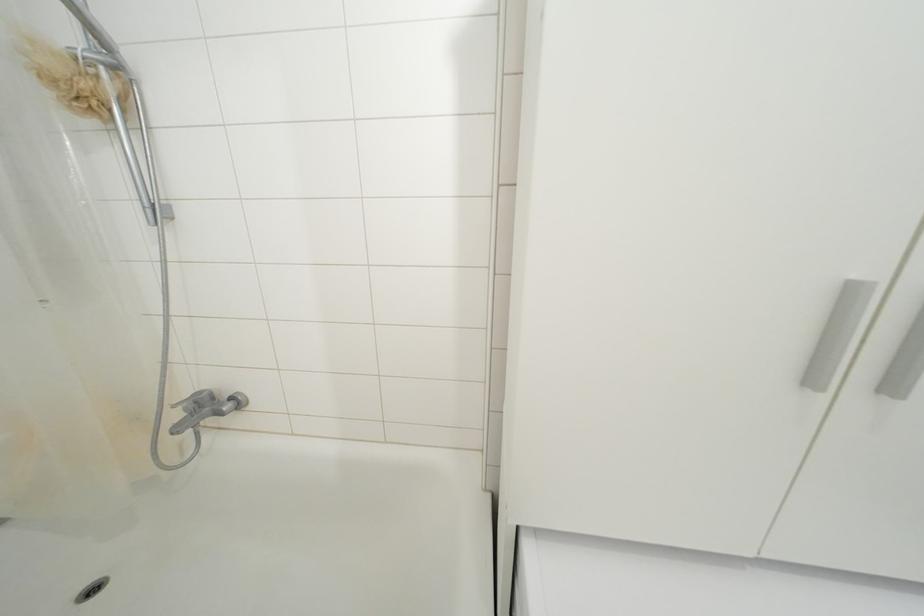
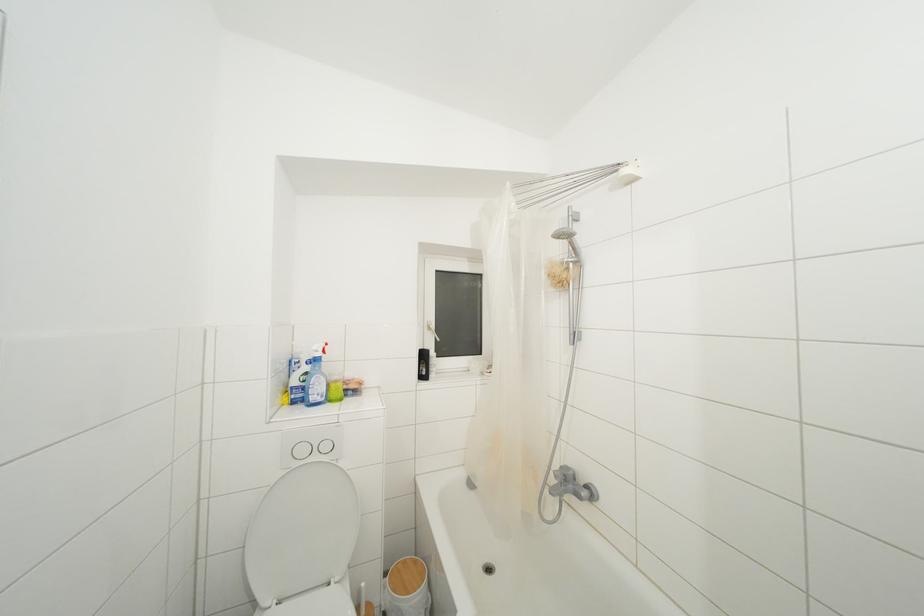
The point at (95, 34) is marked in the first image. Where is the corresponding point in the second image?

(578, 254)